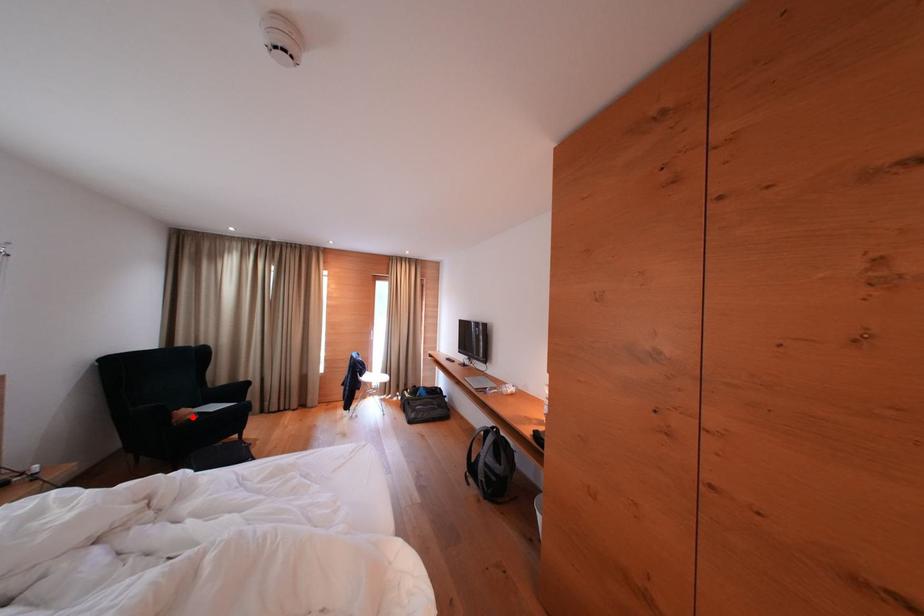
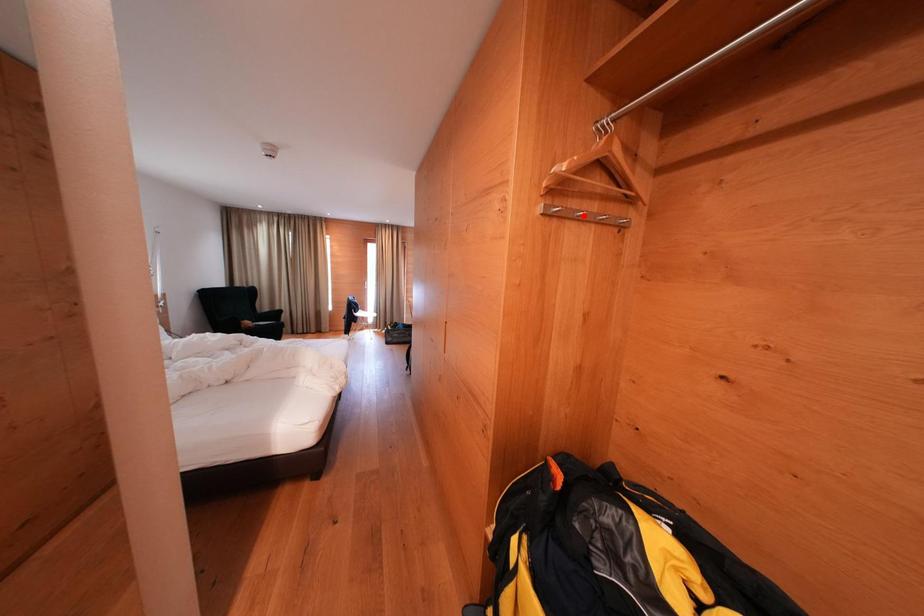
I am providing you with two images of the same scene from different viewpoints. A red point is marked on the first image and another point is marked on the second image. Is the marked point in image1 the same physical position as the marked point in image2?

No